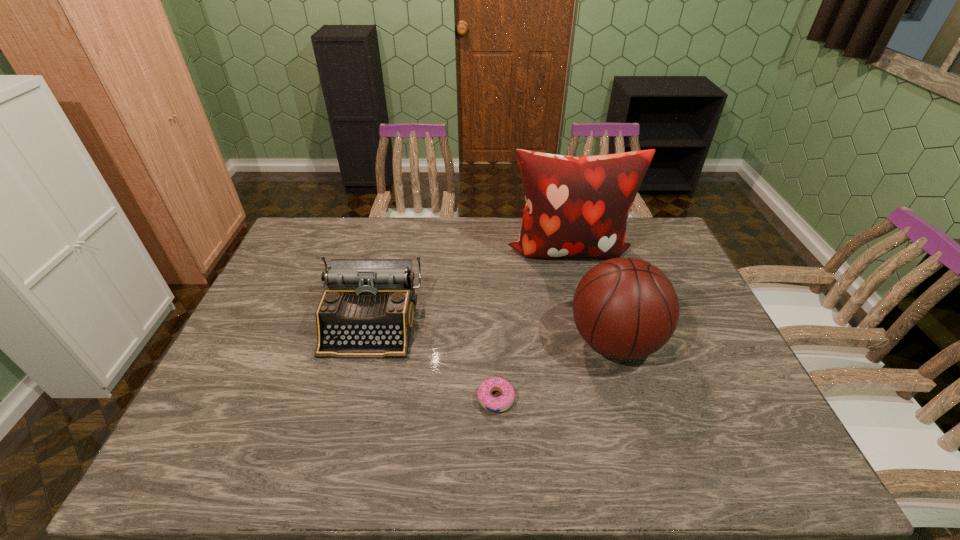
Identify the location of vacant space located 0.080m on the back of the nearest object. (494, 358).

The width and height of the screenshot is (960, 540). I want to click on object situated at the far edge, so click(x=575, y=206).

In order to click on object that is at the right edge in this screenshot , I will do `click(575, 206)`.

At what (x,y) coordinates should I click in order to perform the action: click on object located in the far right corner section of the desktop. Please return your answer as a coordinate pair (x, y). Looking at the image, I should click on (575, 206).

At what (x,y) coordinates should I click in order to perform the action: click on vacant space at the far edge. Please return your answer as a coordinate pair (x, y). The image size is (960, 540). Looking at the image, I should click on (430, 246).

This screenshot has width=960, height=540. I want to click on vacant position at the near edge of the desktop, so click(396, 450).

In the image, there is a desktop. Where is `vacant area at the left edge`? vacant area at the left edge is located at coordinates (315, 291).

I want to click on free space at the right edge of the desktop, so click(x=687, y=385).

The width and height of the screenshot is (960, 540). I want to click on free space at the far left corner of the desktop, so pos(316,247).

Identify the location of vacant space at the near left corner of the desktop. (179, 474).